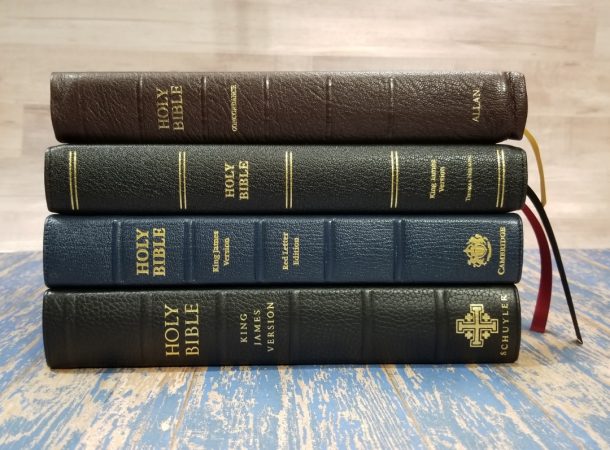
The height and width of the screenshot is (450, 610). Identify the location of black book. (325, 313).